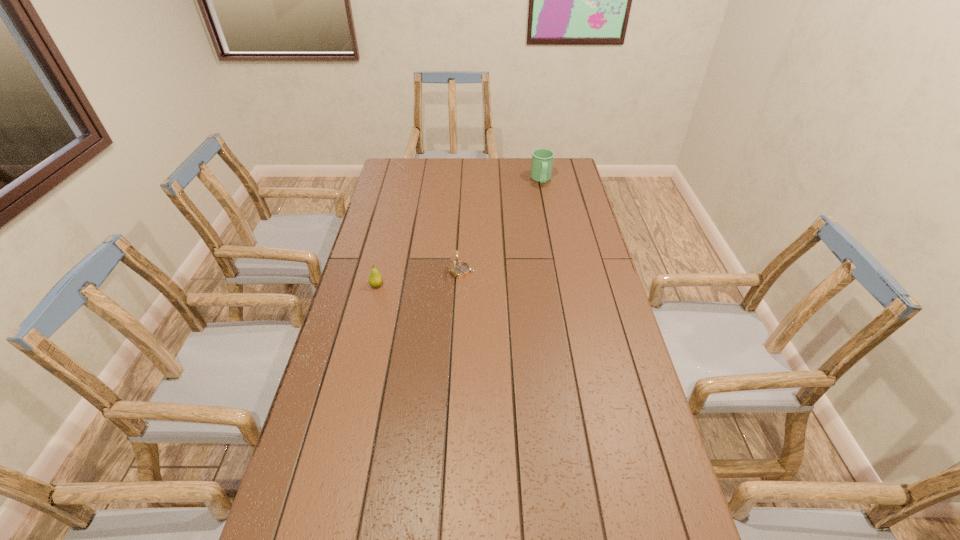
The image size is (960, 540). In order to click on object at the left edge in this screenshot , I will do `click(375, 279)`.

Identify the location of object that is at the right edge. (542, 159).

Find the location of a particular element. The height and width of the screenshot is (540, 960). object present at the far right corner is located at coordinates (542, 159).

In the image, there is a desktop. At what (x,y) coordinates should I click in order to perform the action: click on vacant space at the far edge. Please return your answer as a coordinate pair (x, y). The width and height of the screenshot is (960, 540). Looking at the image, I should click on (443, 158).

Locate an element on the screen. free space at the left edge of the desktop is located at coordinates (342, 454).

In the image, there is a desktop. Find the location of `vacant region at the right edge`. vacant region at the right edge is located at coordinates (578, 233).

I want to click on free space at the far left corner, so click(396, 163).

Locate an element on the screen. Image resolution: width=960 pixels, height=540 pixels. free space that is in between the farthest object and the nearest object is located at coordinates (459, 232).

Where is `empty space that is in between the leftmost object and the farthest object`? empty space that is in between the leftmost object and the farthest object is located at coordinates (459, 232).

The width and height of the screenshot is (960, 540). What are the coordinates of `vacant space that's between the pear and the compass` in the screenshot? It's located at (420, 278).